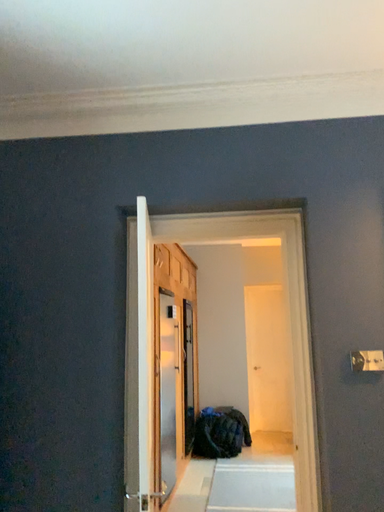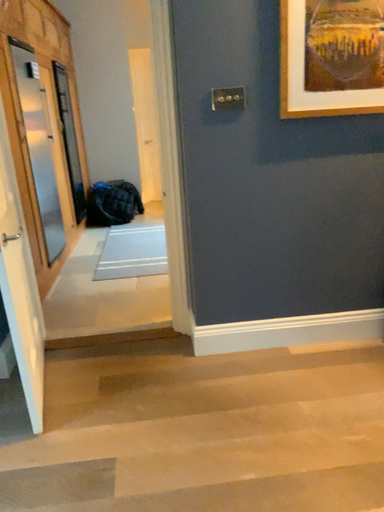
Question: Which way did the camera rotate in the video?

Choices:
 (A) rotated right
 (B) rotated left

Answer: (A)